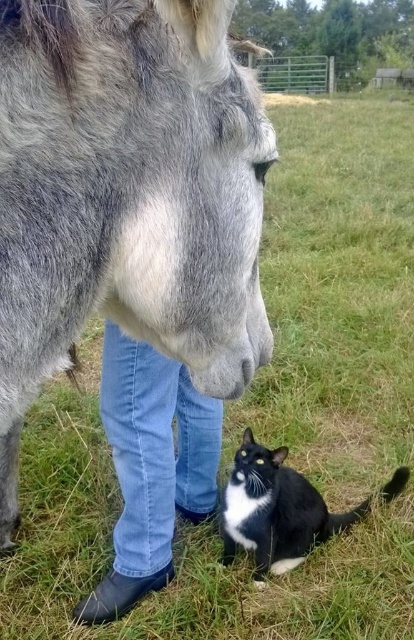
You are standing in a grassy field and see the blue jeans at lower center and the black glossy fur cat at lower right. Which object is nearer to you?

The blue jeans at lower center is closer to the viewer than the black glossy fur cat at lower right.

You are a photographer trying to capture a photo of the black glossy fur cat at lower right. You notice the blue jeans at lower center might block the view. Can you determine if the cat is partially hidden by the jeans?

The blue jeans at lower center is bigger than black glossy fur cat at lower right, so there is a possibility that the cat is partially hidden by the jeans.